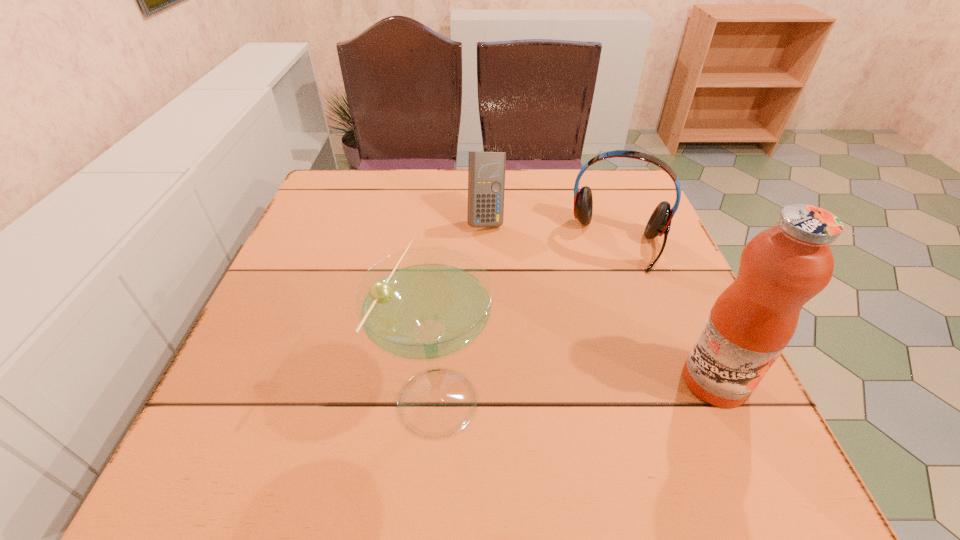
This screenshot has height=540, width=960. In order to click on free space at the near edge in this screenshot , I will do `click(631, 380)`.

Locate an element on the screen. free space at the left edge is located at coordinates (338, 242).

Where is `free space at the right edge of the desktop`? The height and width of the screenshot is (540, 960). free space at the right edge of the desktop is located at coordinates (671, 312).

In the image, there is a desktop. In order to click on vacant space at the near left corner in this screenshot , I will do `click(239, 379)`.

Where is `free region at the far right corner`? The height and width of the screenshot is (540, 960). free region at the far right corner is located at coordinates (630, 200).

You are a GUI agent. You are given a task and a screenshot of the screen. Output one action in this format:
    pyautogui.click(x=<x>, y=<y>)
    Task: Click on the empty space between the fruit juice and the headset
    This screenshot has width=960, height=540.
    Given the screenshot: What is the action you would take?
    pyautogui.click(x=667, y=312)

Where is `vacant region between the second tallest object and the tallest object`? The height and width of the screenshot is (540, 960). vacant region between the second tallest object and the tallest object is located at coordinates (576, 388).

You are a GUI agent. You are given a task and a screenshot of the screen. Output one action in this format:
    pyautogui.click(x=<x>, y=<y>)
    Task: Click on the free point between the martini and the tallest object
    This screenshot has height=540, width=960.
    Given the screenshot: What is the action you would take?
    pyautogui.click(x=576, y=388)

This screenshot has width=960, height=540. I want to click on free spot between the headset and the calculator, so click(x=553, y=231).

This screenshot has height=540, width=960. Identify the location of unoccupied position between the headset and the calculator. (553, 231).